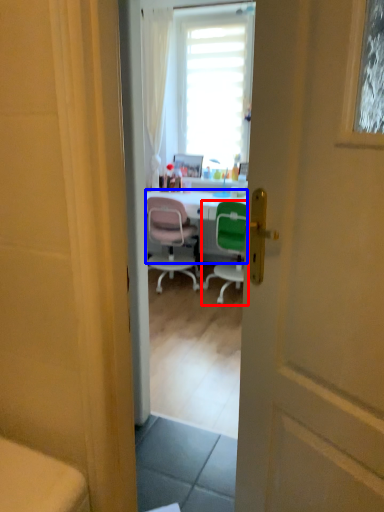
Question: Which of the following is the closest to the observer, chair (highlighted by a red box) or desk (highlighted by a blue box)?

Choices:
 (A) chair
 (B) desk

Answer: (A)